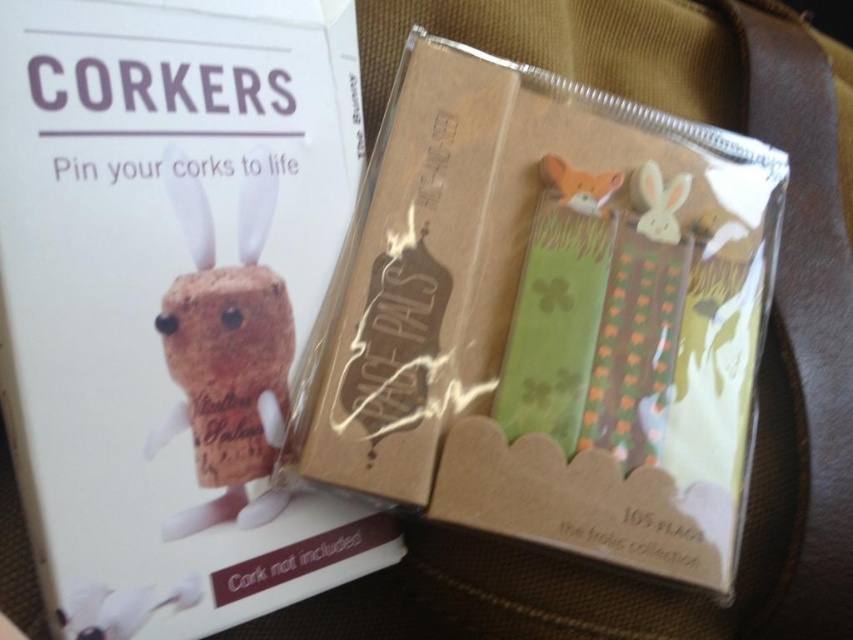
Question: Which object is the farthest from the matte brown bookmark at center?

Choices:
 (A) matte white bunny at lower left
 (B) matte brown cork at upper left

Answer: (A)

Question: Is matte white bunny at lower left wider than white matte bunny at upper right?

Choices:
 (A) yes
 (B) no

Answer: (A)

Question: Which of the following is the closest to the observer?

Choices:
 (A) (682, 186)
 (B) (68, 260)

Answer: (B)

Question: Where is matte brown bookmark at center located in relation to matte white bunny at lower left in the image?

Choices:
 (A) right
 (B) left

Answer: (A)

Question: Among these objects, which one is farthest from the camera?

Choices:
 (A) matte brown bookmark at center
 (B) matte white bunny at lower left
 (C) matte brown cork at upper left
 (D) white matte bunny at upper right

Answer: (D)

Question: Does white matte bunny at upper right appear on the left side of matte orange fox at upper center?

Choices:
 (A) yes
 (B) no

Answer: (B)